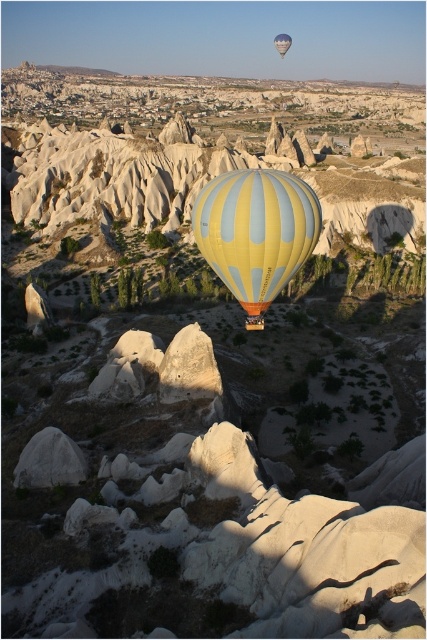
Looking at this image, you are a photographer planning to capture the fairy chimneys and the hot air balloon in one shot. The camera you have can only focus on objects within a 100m width. Given the description, will both the yellow striped balloon at center and the yellow striped fabric hot air balloon at center fit within the camera frame?

The yellow striped balloon at center is wider than the yellow striped fabric hot air balloon at center. However, since both are the same object, their combined width would exceed the camera frame. Therefore, they cannot both fit within the 100m width.

You are standing at the center of the image and want to walk directly to the yellow striped balloon at center. According to the coordinates provided in the Objects Description, in which direction should you move relative to your current position?

The yellow striped balloon at center is located at point coordinates 0.366 along the x and 0.600 along the y. Since you are at the center, which is typically coordinates 0.5 in both axes, you would need to move slightly to the left and down to reach it.

You are a tourist standing on the ground looking at the yellow striped balloon at center and the yellow striped fabric hot air balloon at center. Which one is taller?

The yellow striped balloon at center is taller than the yellow striped fabric hot air balloon at center.